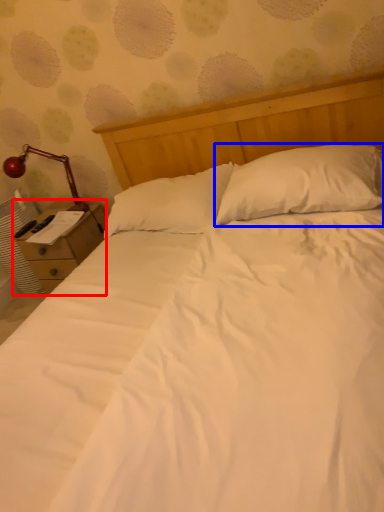
Question: Which object appears closest to the camera in this image, nightstand (highlighted by a red box) or pillow (highlighted by a blue box)?

Choices:
 (A) nightstand
 (B) pillow

Answer: (B)